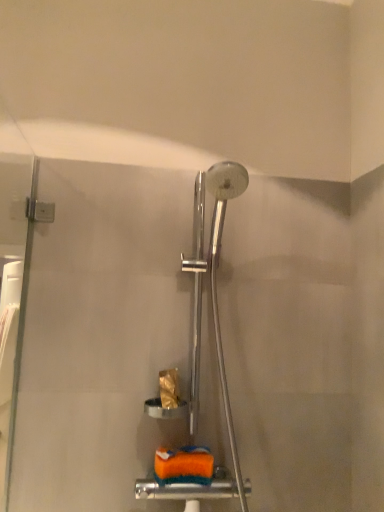
Question: Based on their positions, is gold textured toilet paper at center located to the left or right of orange sponge at lower center?

Choices:
 (A) right
 (B) left

Answer: (B)

Question: Looking at their shapes, would you say gold textured toilet paper at center is wider or thinner than orange sponge at lower center?

Choices:
 (A) wide
 (B) thin

Answer: (B)

Question: Do you think gold textured toilet paper at center is within orange sponge at lower center, or outside of it?

Choices:
 (A) inside
 (B) outside

Answer: (B)

Question: Considering the relative positions of orange sponge at lower center and gold textured toilet paper at center in the image provided, is orange sponge at lower center to the left or to the right of gold textured toilet paper at center?

Choices:
 (A) left
 (B) right

Answer: (B)

Question: From the image's perspective, is orange sponge at lower center positioned above or below gold textured toilet paper at center?

Choices:
 (A) above
 (B) below

Answer: (B)

Question: Considering their positions, is orange sponge at lower center located in front of or behind gold textured toilet paper at center?

Choices:
 (A) front
 (B) behind

Answer: (A)

Question: Is point (165, 464) positioned closer to the camera than point (173, 406)?

Choices:
 (A) farther
 (B) closer

Answer: (B)